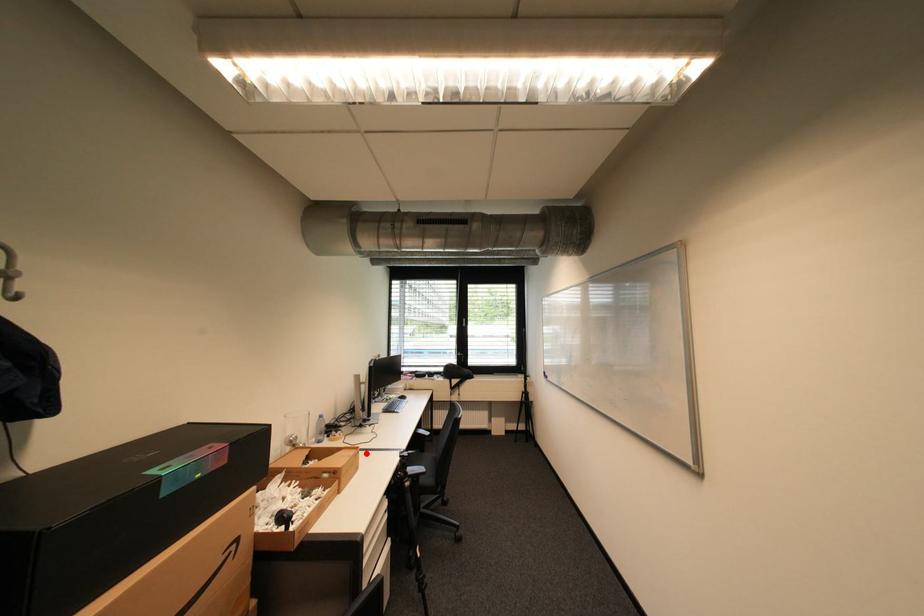
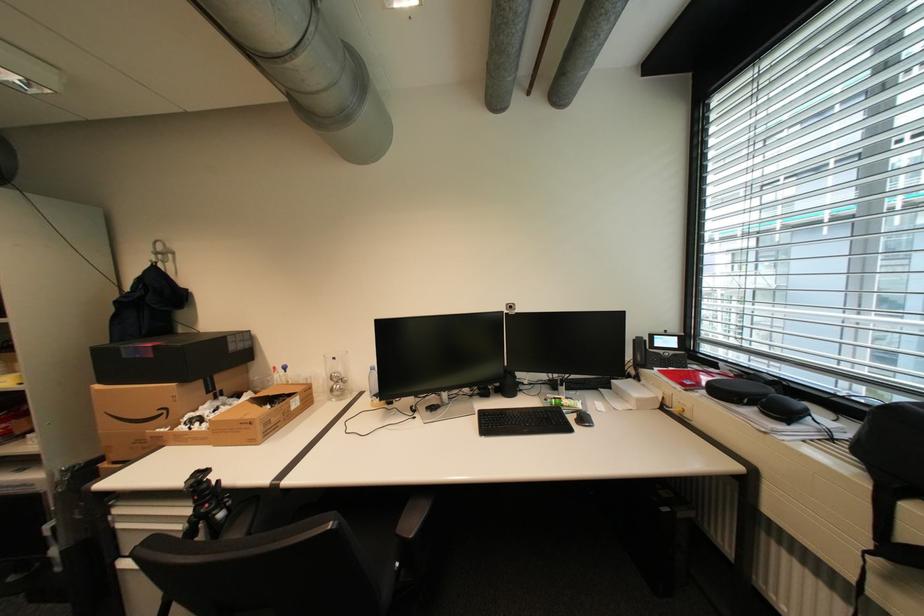
Where in the second image is the point corresponding to the highlighted location from the first image?

(259, 424)